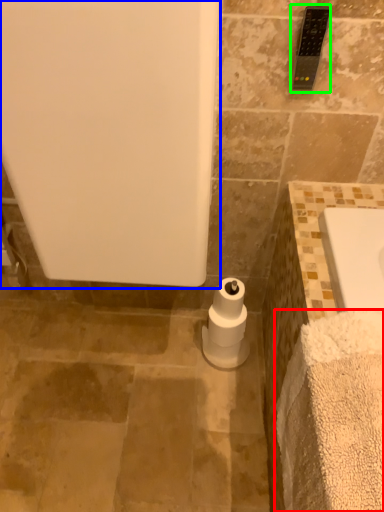
Question: Which object is the closest to the bath towel (highlighted by a red box)? Choose among these: bath (highlighted by a blue box) or towel bar (highlighted by a green box).

Choices:
 (A) bath
 (B) towel bar

Answer: (A)